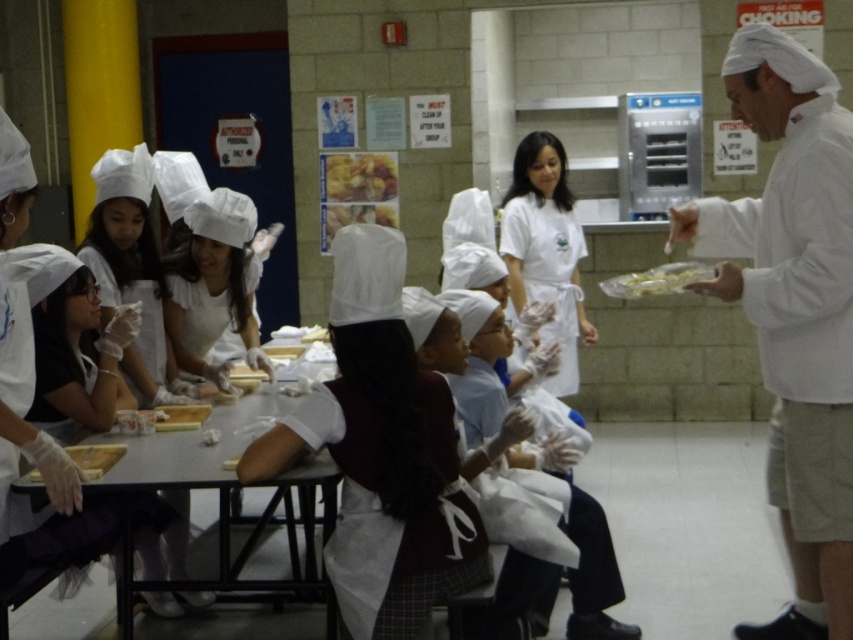
Is smooth white table at center bigger than golden brown crumbly pastry at center?

Yes.

Which is more to the right, smooth white table at center or golden brown crumbly pastry at center?

golden brown crumbly pastry at center is more to the right.

Find the location of a particular element. The width and height of the screenshot is (853, 640). smooth white table at center is located at coordinates (225, 509).

Can you confirm if smooth white table at center is positioned above yellow matte pasta at center?

No, smooth white table at center is not above yellow matte pasta at center.

Who is higher up, smooth white table at center or yellow matte pasta at center?

yellow matte pasta at center is higher up.

Is point (280, 480) positioned after point (670, 275)?

No, it is in front of (670, 275).

Where is `smooth white table at center`? This screenshot has width=853, height=640. smooth white table at center is located at coordinates (225, 509).

Measure the distance from white matte chef hat at right to smooth white table at center.

A distance of 6.09 feet exists between white matte chef hat at right and smooth white table at center.

Who is more distant from viewer, (828, 636) or (300, 477)?

Positioned behind is point (828, 636).

The width and height of the screenshot is (853, 640). Describe the element at coordinates (793, 308) in the screenshot. I see `white matte chef hat at right` at that location.

Locate an element on the screen. white matte chef hat at right is located at coordinates (793, 308).